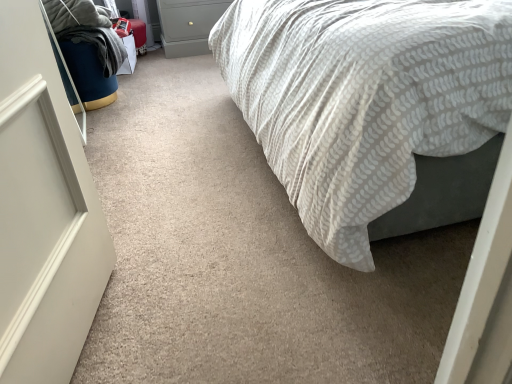
Question: Considering the positions of velvet blue bean bag at left and white textured fabric bed at center in the image, is velvet blue bean bag at left bigger or smaller than white textured fabric bed at center?

Choices:
 (A) small
 (B) big

Answer: (A)

Question: Considering the positions of velvet blue bean bag at left and white textured fabric bed at center in the image, is velvet blue bean bag at left wider or thinner than white textured fabric bed at center?

Choices:
 (A) wide
 (B) thin

Answer: (B)

Question: Considering the real-world distances, which object is farthest from the white textured fabric bed at center?

Choices:
 (A) velvet blue bean bag at left
 (B) matte gray drawer at upper center

Answer: (B)

Question: Estimate the real-world distances between objects in this image. Which object is closer to the velvet blue bean bag at left?

Choices:
 (A) matte gray drawer at upper center
 (B) white textured fabric bed at center

Answer: (A)